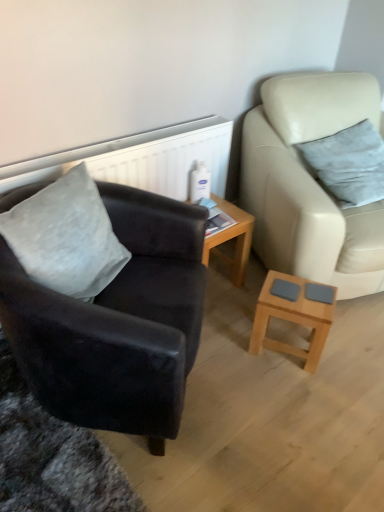
Find the location of a particular element. The height and width of the screenshot is (512, 384). free spot above wooden table at center (from a real-world perspective) is located at coordinates (216, 214).